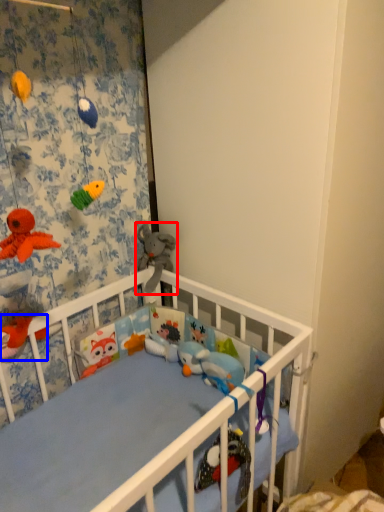
Question: Among these objects, which one is nearest to the camera, toy (highlighted by a red box) or toy (highlighted by a blue box)?

Choices:
 (A) toy
 (B) toy

Answer: (B)